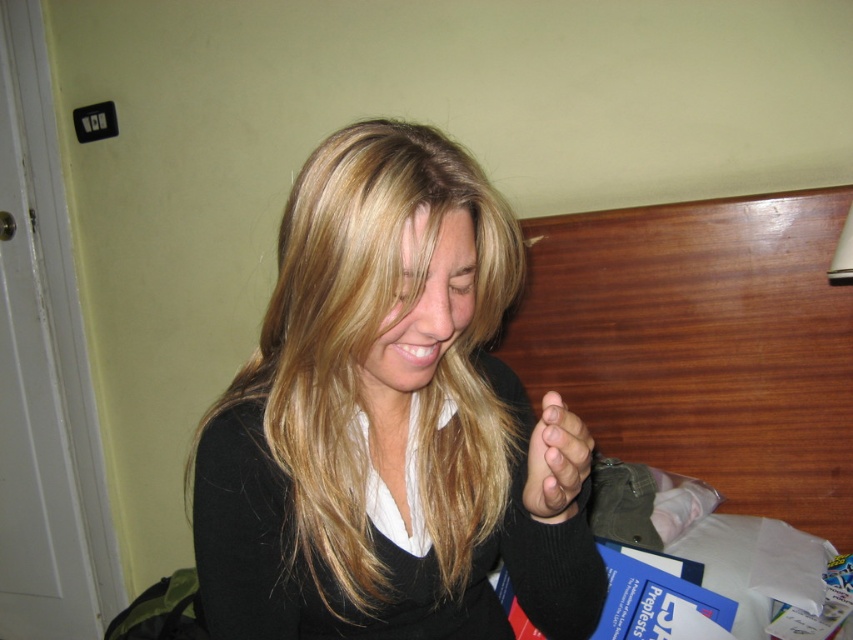
You are a fashion designer trying to decide if the smooth black sweater at center can be folded and placed into the smooth skin hand at center. Based on their sizes, is this possible?

The smooth black sweater at center might be wider than smooth skin hand at center, so it may not fit entirely into the hand unless folded carefully.